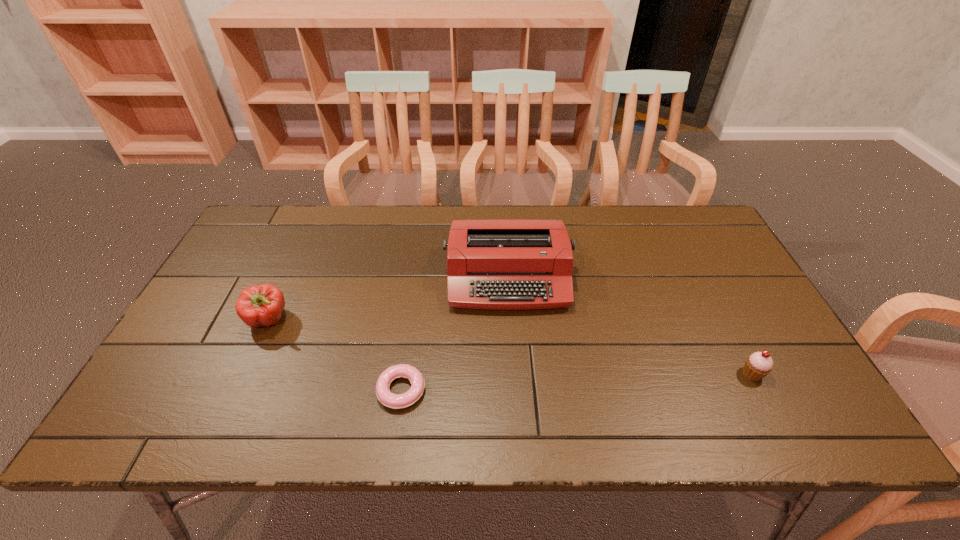
Find the location of `object that is the second closest to the doughnut`. object that is the second closest to the doughnut is located at coordinates (259, 305).

Identify the location of free space in the image that satisfies the following two spatial constraints: 1. on the typing side of the typewriter; 2. on the right side of the third tallest object. The image size is (960, 540). (515, 374).

Find the location of `vacant point that satisfies the following two spatial constraints: 1. on the front side of the leftmost object; 2. on the left side of the shortest object`. vacant point that satisfies the following two spatial constraints: 1. on the front side of the leftmost object; 2. on the left side of the shortest object is located at coordinates (237, 390).

Locate an element on the screen. This screenshot has height=540, width=960. vacant space that satisfies the following two spatial constraints: 1. on the front side of the shortest object; 2. on the right side of the leftmost object is located at coordinates (237, 390).